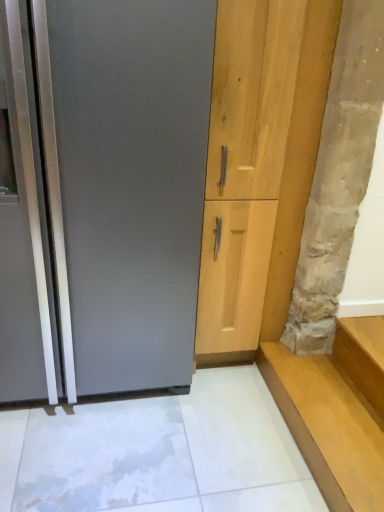
Describe the element at coordinates (103, 194) in the screenshot. I see `satin gray refrigerator at left` at that location.

Locate an element on the screen. The width and height of the screenshot is (384, 512). satin gray refrigerator at left is located at coordinates (x=103, y=194).

Locate an element on the screen. The image size is (384, 512). satin gray refrigerator at left is located at coordinates (103, 194).